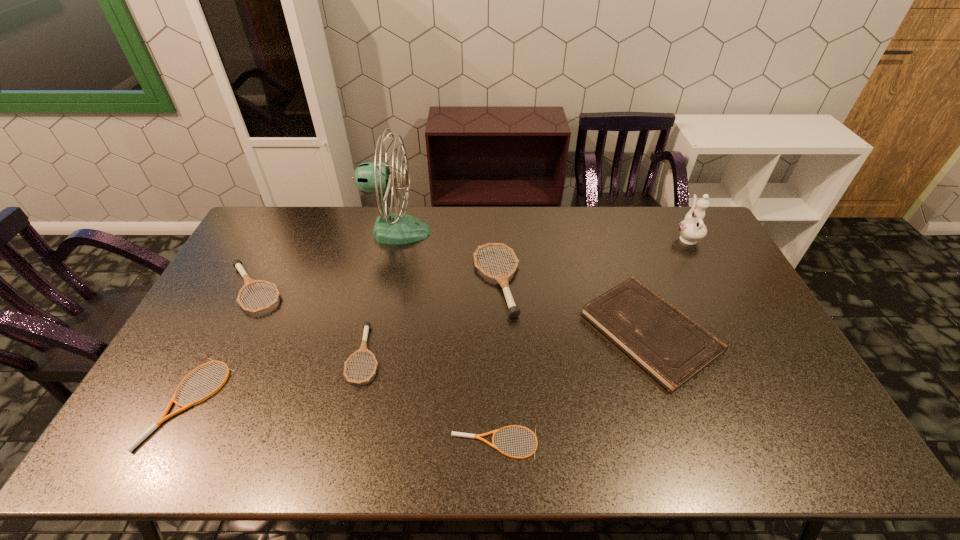
In the image, there is a desktop. Where is `vacant space at the right edge`? The width and height of the screenshot is (960, 540). vacant space at the right edge is located at coordinates (745, 329).

You are a GUI agent. You are given a task and a screenshot of the screen. Output one action in this format:
    pyautogui.click(x=<x>, y=<y>)
    Task: Click on the free spot at the far right corner of the desktop
    The width and height of the screenshot is (960, 540).
    Given the screenshot: What is the action you would take?
    pyautogui.click(x=659, y=215)

The image size is (960, 540). What are the coordinates of `free space between the fourth shortest tennis racket and the rightmost gray tennis racket` in the screenshot? It's located at (375, 285).

This screenshot has height=540, width=960. I want to click on vacant space that's between the shortest tennis racket and the tallest tennis racket, so click(x=495, y=362).

This screenshot has width=960, height=540. Find the location of `free space between the fourth shortest tennis racket and the third tennis racket from left to right`. free space between the fourth shortest tennis racket and the third tennis racket from left to right is located at coordinates (309, 322).

In order to click on free point between the tallest tennis racket and the leftmost gray tennis racket in this screenshot , I will do `click(375, 285)`.

Image resolution: width=960 pixels, height=540 pixels. In order to click on free space between the second tallest object and the second object from right to left in this screenshot , I will do `click(668, 285)`.

What are the coordinates of `vacant space in between the second tallest tennis racket and the paperback book` in the screenshot? It's located at (452, 310).

Find the location of `free space between the tallest tennis racket and the right beige tennis racket`. free space between the tallest tennis racket and the right beige tennis racket is located at coordinates (495, 362).

You are a GUI agent. You are given a task and a screenshot of the screen. Output one action in this format:
    pyautogui.click(x=<x>, y=<y>)
    Task: Click on the free space between the shortest object and the biggest gray tennis racket
    This screenshot has width=960, height=540.
    Given the screenshot: What is the action you would take?
    pyautogui.click(x=495, y=362)